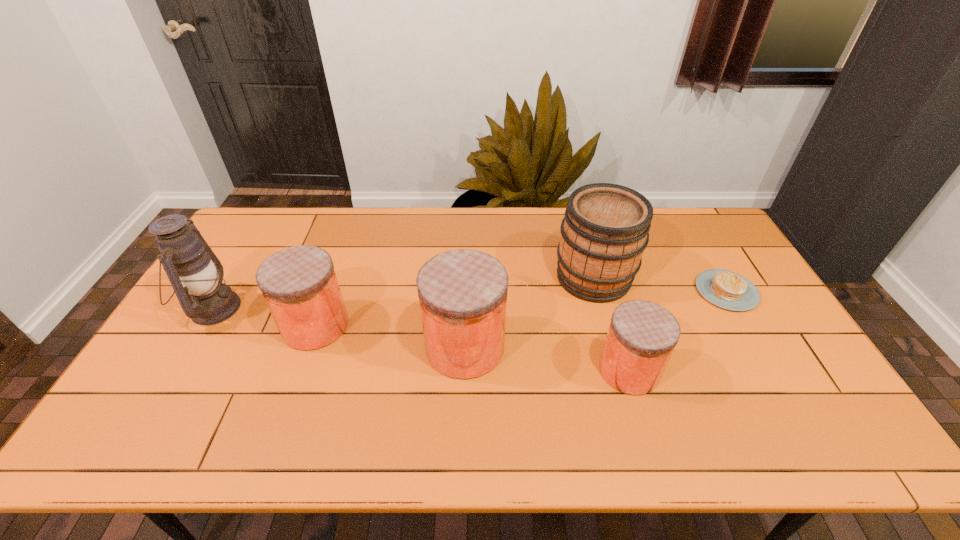
All jars are currently evenly spaced. To continue this pattern, where would you add another jar on the right? Please point out a vacant spot. Please provide its 2D coordinates. Your answer should be formatted as a tuple, i.e. [(x, y)], where the tuple contains the x and y coordinates of a point satisfying the conditions above.

[(809, 396)]